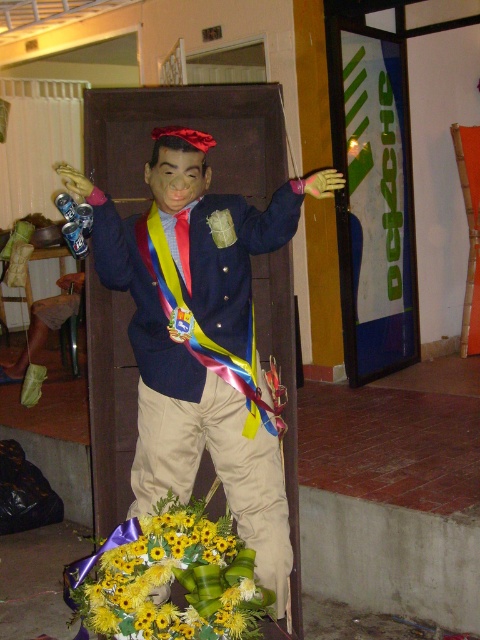
Question: Does matte plastic boy at center lie in front of yellow artificial flowers at lower center?

Choices:
 (A) no
 (B) yes

Answer: (A)

Question: Can you confirm if matte plastic boy at center is wider than yellow artificial flowers at lower center?

Choices:
 (A) no
 (B) yes

Answer: (B)

Question: Among these points, which one is nearest to the camera?

Choices:
 (A) (155, 467)
 (B) (94, 579)

Answer: (B)

Question: Which of the following is the closest to the observer?

Choices:
 (A) yellow artificial flowers at lower center
 (B) matte plastic boy at center

Answer: (A)

Question: Which point is farther to the camera?

Choices:
 (A) (75, 577)
 (B) (167, 332)

Answer: (A)

Question: Is matte plastic boy at center to the left of yellow artificial flowers at lower center from the viewer's perspective?

Choices:
 (A) no
 (B) yes

Answer: (A)